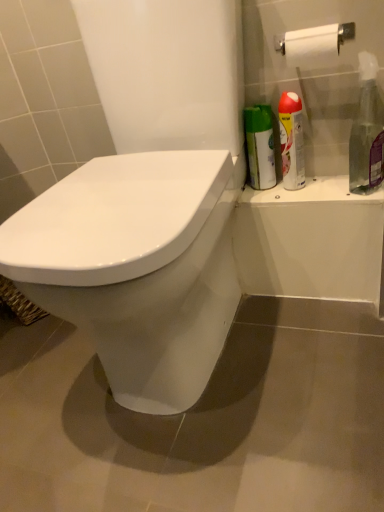
Locate an element on the screen. vacant area in front of silver metallic spray can at upper right, the 2th cleaning product in the right-to-left sequence is located at coordinates (321, 194).